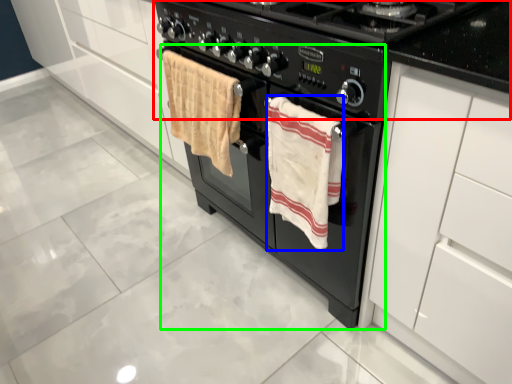
Question: Which object is positioned farthest from gas stove (highlighted by a red box)? Select from beach towel (highlighted by a blue box) and oven (highlighted by a green box).

Choices:
 (A) beach towel
 (B) oven

Answer: (B)